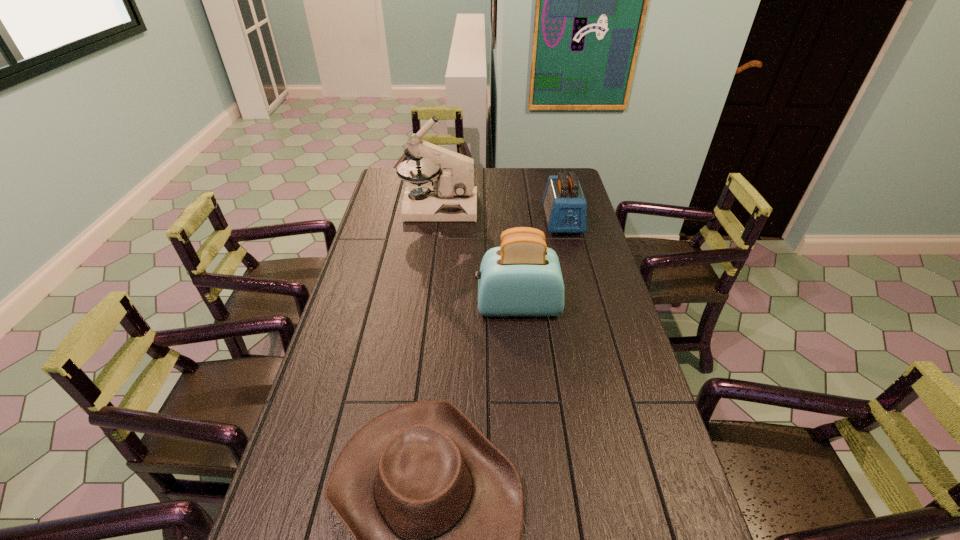
You are a GUI agent. You are given a task and a screenshot of the screen. Output one action in this format:
    pyautogui.click(x=<x>, y=<y>)
    Task: Click on the object at the left edge
    
    Given the screenshot: What is the action you would take?
    pyautogui.click(x=452, y=197)

The width and height of the screenshot is (960, 540). Find the location of `object situated at the right edge`. object situated at the right edge is located at coordinates (565, 206).

The height and width of the screenshot is (540, 960). In the image, there is a desktop. In order to click on vacant space at the left edge in this screenshot , I will do `click(299, 537)`.

In the image, there is a desktop. Identify the location of vacant space at the right edge. The image size is (960, 540). (574, 254).

This screenshot has height=540, width=960. What are the coordinates of `free space between the microscope and the right toaster` in the screenshot? It's located at (501, 214).

The image size is (960, 540). I want to click on vacant space in between the microscope and the second tallest object, so click(x=478, y=257).

The image size is (960, 540). In order to click on the second closest object to the third shortest object in this screenshot , I will do `click(565, 206)`.

Identify which object is located as the third nearest to the right toaster. Please provide its 2D coordinates. Your answer should be formatted as a tuple, i.e. [(x, y)], where the tuple contains the x and y coordinates of a point satisfying the conditions above.

[(436, 510)]